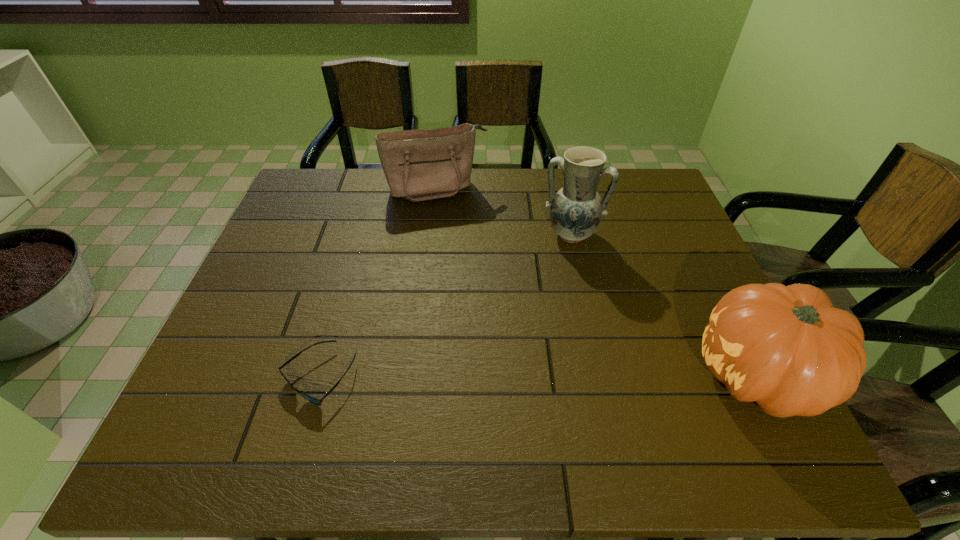
Locate an element on the screen. The height and width of the screenshot is (540, 960). empty space that is in between the pumpkin and the shoulder bag is located at coordinates (597, 282).

This screenshot has height=540, width=960. I want to click on vacant area between the sunglasses and the shoulder bag, so click(378, 282).

Find the location of a particular element. The height and width of the screenshot is (540, 960). free spot between the rightmost object and the farthest object is located at coordinates pyautogui.click(x=597, y=282).

Locate an element on the screen. free space between the rightmost object and the second object from right to left is located at coordinates (664, 305).

Locate which object is the closest to the farthest object. Please provide its 2D coordinates. Your answer should be formatted as a tuple, i.e. [(x, y)], where the tuple contains the x and y coordinates of a point satisfying the conditions above.

[(576, 210)]

The height and width of the screenshot is (540, 960). I want to click on the second closest object to the shortest object, so click(x=576, y=210).

Locate an element on the screen. This screenshot has height=540, width=960. vacant area in the image that satisfies the following two spatial constraints: 1. on the front side of the farthest object; 2. on the carved face of the rightmost object is located at coordinates (415, 376).